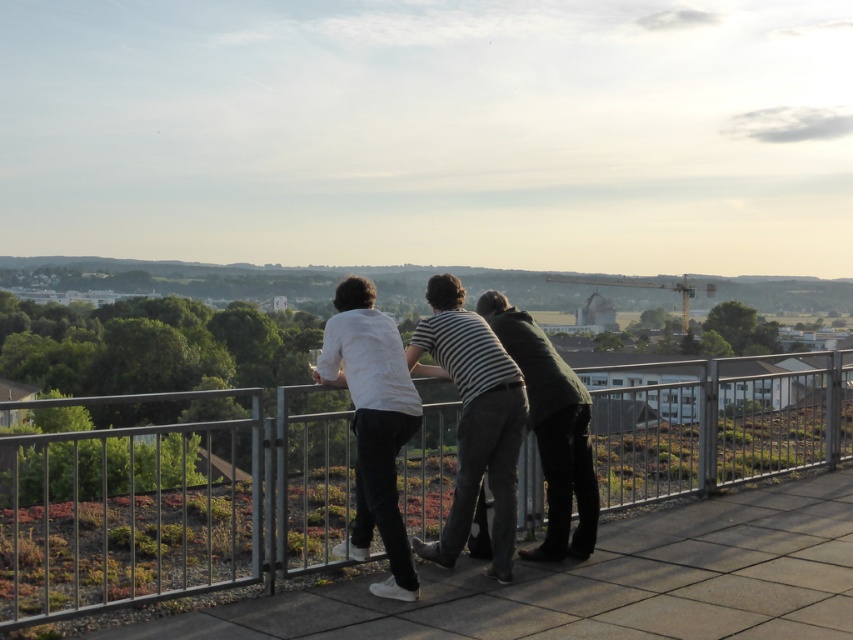
Question: Observing the image, what is the correct spatial positioning of metallic silver fence at center in reference to dark green sweater at center?

Choices:
 (A) below
 (B) above

Answer: (A)

Question: Which object appears closest to the camera in this image?

Choices:
 (A) striped cotton shirt at center
 (B) dark green sweater at center
 (C) metallic silver fence at center
 (D) white matte shirt at center

Answer: (C)

Question: Considering the real-world distances, which object is farthest from the metallic silver fence at center?

Choices:
 (A) striped cotton shirt at center
 (B) white matte shirt at center
 (C) dark green sweater at center

Answer: (C)

Question: Does striped cotton shirt at center have a lesser width compared to white matte shirt at center?

Choices:
 (A) no
 (B) yes

Answer: (A)

Question: Considering the relative positions of striped cotton shirt at center and dark green sweater at center in the image provided, where is striped cotton shirt at center located with respect to dark green sweater at center?

Choices:
 (A) left
 (B) right

Answer: (A)

Question: Considering the real-world distances, which object is farthest from the dark green sweater at center?

Choices:
 (A) metallic silver fence at center
 (B) striped cotton shirt at center
 (C) white matte shirt at center

Answer: (A)